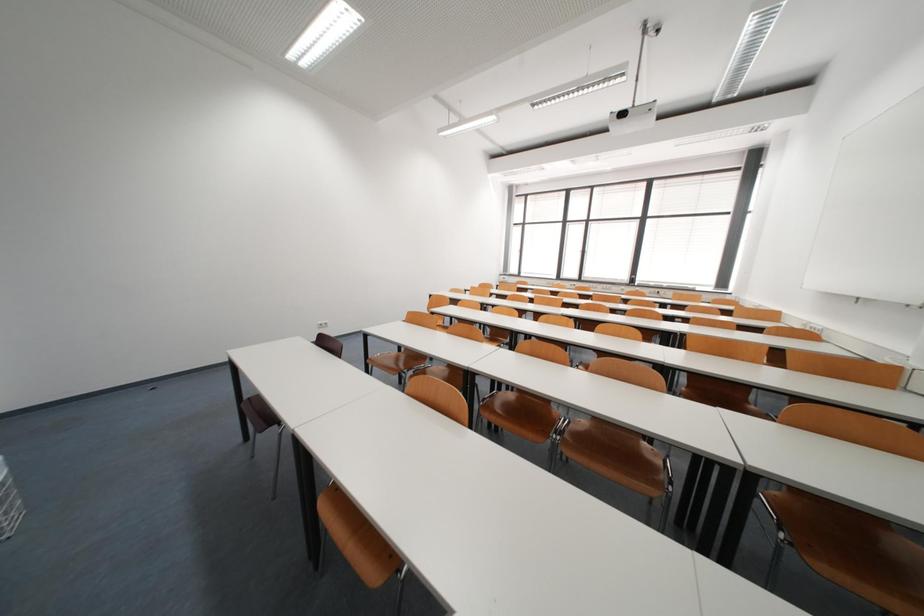
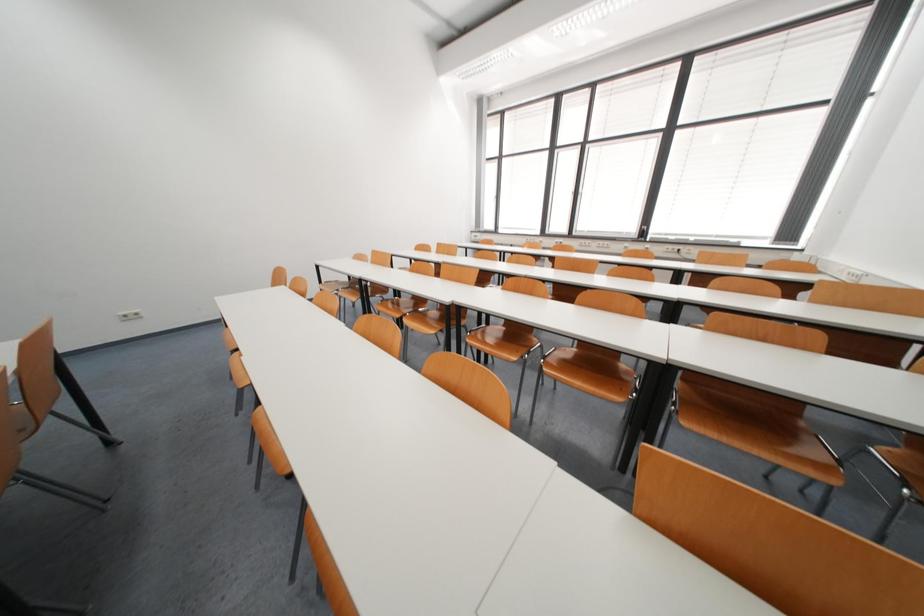
Which direction would the cameraman need to move to produce the second image?

The cameraman moved toward right, forward.